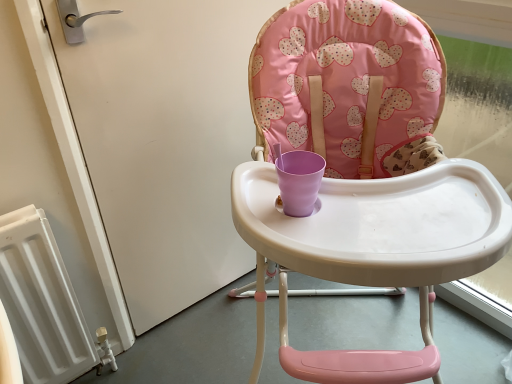
Question: Can you confirm if pink fabric highchair at center is wider than white glossy screen door at left?

Choices:
 (A) no
 (B) yes

Answer: (B)

Question: Is pink fabric highchair at center oriented away from white glossy screen door at left?

Choices:
 (A) yes
 (B) no

Answer: (B)

Question: Can you confirm if pink fabric highchair at center is positioned to the right of white glossy screen door at left?

Choices:
 (A) no
 (B) yes

Answer: (B)

Question: Is pink fabric highchair at center positioned beyond the bounds of white glossy screen door at left?

Choices:
 (A) no
 (B) yes

Answer: (B)

Question: Are pink fabric highchair at center and white glossy screen door at left making contact?

Choices:
 (A) yes
 (B) no

Answer: (B)

Question: Can you confirm if pink fabric highchair at center is shorter than white glossy screen door at left?

Choices:
 (A) yes
 (B) no

Answer: (B)

Question: Is white glossy screen door at left in front of pink fabric highchair at center?

Choices:
 (A) yes
 (B) no

Answer: (B)

Question: Is white glossy screen door at left oriented away from pink fabric highchair at center?

Choices:
 (A) yes
 (B) no

Answer: (B)

Question: Does white glossy screen door at left appear on the right side of pink fabric highchair at center?

Choices:
 (A) no
 (B) yes

Answer: (A)

Question: From a real-world perspective, is white glossy screen door at left under pink fabric highchair at center?

Choices:
 (A) no
 (B) yes

Answer: (A)

Question: Is white glossy screen door at left placed right next to pink fabric highchair at center?

Choices:
 (A) no
 (B) yes

Answer: (A)

Question: Considering the relative sizes of white glossy screen door at left and pink fabric highchair at center in the image provided, is white glossy screen door at left thinner than pink fabric highchair at center?

Choices:
 (A) yes
 (B) no

Answer: (A)

Question: From their relative heights in the image, would you say white glossy screen door at left is taller or shorter than pink fabric highchair at center?

Choices:
 (A) tall
 (B) short

Answer: (B)